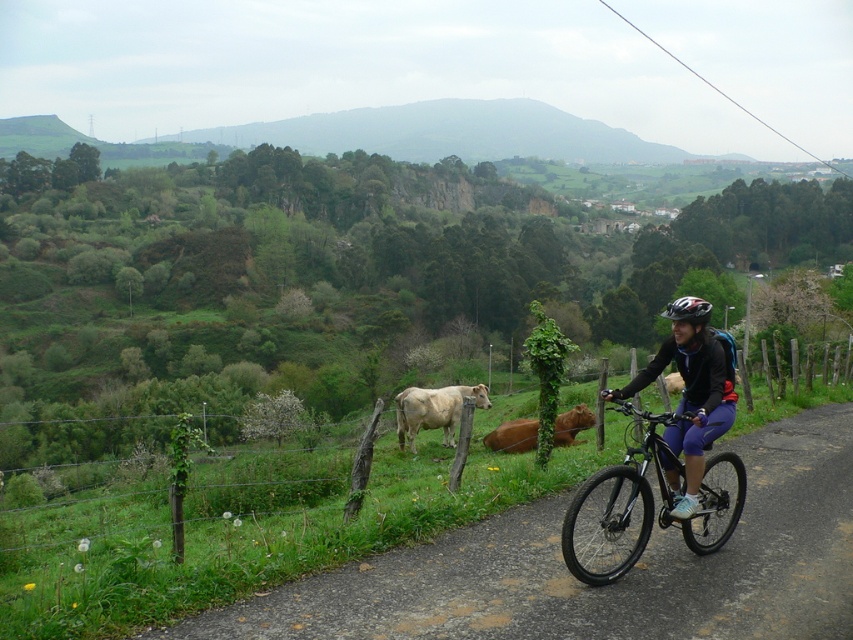
Question: Does white glossy cow at center appear on the right side of brown leather cow at center?

Choices:
 (A) no
 (B) yes

Answer: (A)

Question: Based on their relative distances, which object is farther from the green wooden fence at lower center?

Choices:
 (A) matte black bicycle at center
 (B) shiny metallic bicycle at center
 (C) matte black helmet at center
 (D) brown leather cow at center

Answer: (A)

Question: Which of the following is the closest to the observer?

Choices:
 (A) (584, 547)
 (B) (727, 401)

Answer: (B)

Question: Is matte black bicycle at center positioned before matte black helmet at center?

Choices:
 (A) no
 (B) yes

Answer: (B)

Question: Does green wooden fence at lower center have a greater width compared to brown leather cow at center?

Choices:
 (A) no
 (B) yes

Answer: (B)

Question: Among these points, which one is farthest from the camera?

Choices:
 (A) (701, 321)
 (B) (606, 486)
 (C) (704, 504)

Answer: (B)